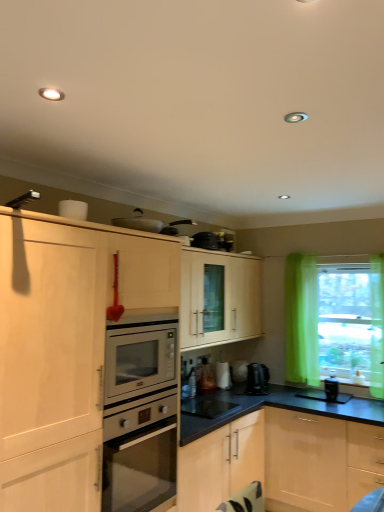
Where is `vacant space in black glossy microwave at center, the 2th appliance when ordered from front to back (from a real-world perspective)`? vacant space in black glossy microwave at center, the 2th appliance when ordered from front to back (from a real-world perspective) is located at coordinates (221, 410).